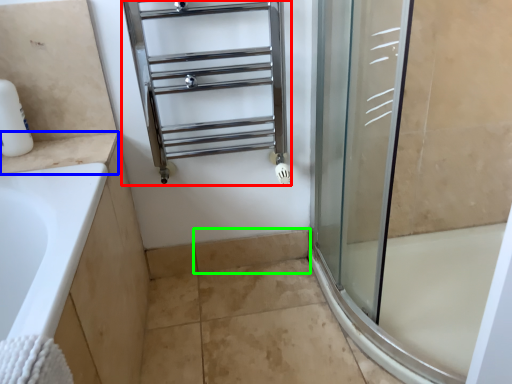
Question: Based on their relative distances, which object is farther from shelf (highlighted by a red box)? Choose from counter top (highlighted by a blue box) and tile (highlighted by a green box).

Choices:
 (A) counter top
 (B) tile

Answer: (B)